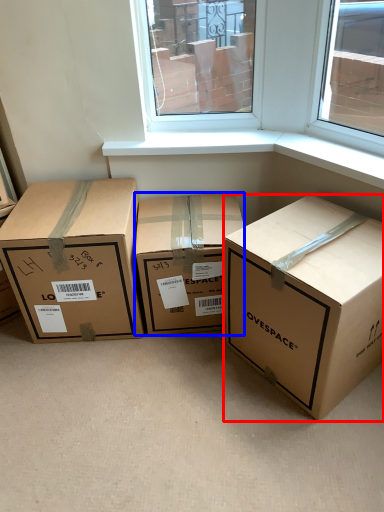
Question: Which point is further to the camera, box (highlighted by a red box) or box (highlighted by a blue box)?

Choices:
 (A) box
 (B) box

Answer: (B)